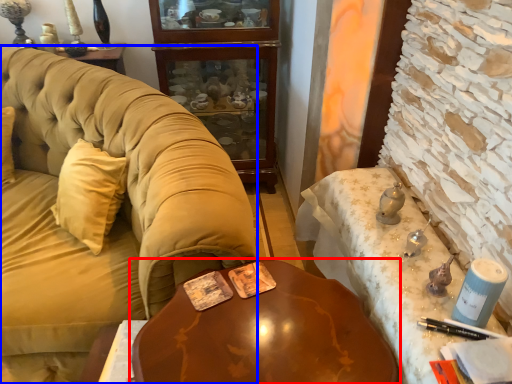
Question: Which point is closer to the camera, table (highlighted by a red box) or studio couch (highlighted by a blue box)?

Choices:
 (A) table
 (B) studio couch

Answer: (A)